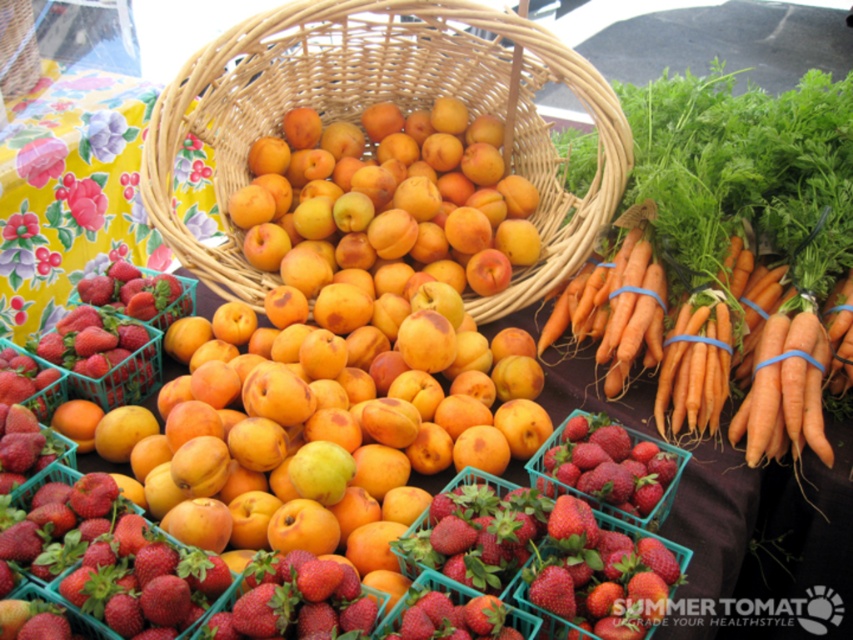
Question: Does yellow matte apricot at center appear over woven wicker basket at upper center?

Choices:
 (A) no
 (B) yes

Answer: (A)

Question: Which point appears farthest from the camera in this image?

Choices:
 (A) (323, 595)
 (B) (322, 157)
 (C) (492, 102)
 (D) (22, 45)

Answer: (D)

Question: Among these points, which one is nearest to the camera?

Choices:
 (A) (6, 42)
 (B) (184, 257)

Answer: (B)

Question: Can you confirm if yellow-orange peaches at center is thinner than shiny red strawberries at center?

Choices:
 (A) no
 (B) yes

Answer: (A)

Question: Is shiny red strawberries at center to the right of woven wicker basket at upper center from the viewer's perspective?

Choices:
 (A) yes
 (B) no

Answer: (A)

Question: Which object appears farthest from the camera in this image?

Choices:
 (A) woven wicker basket at upper center
 (B) woven wicker basket at center

Answer: (A)